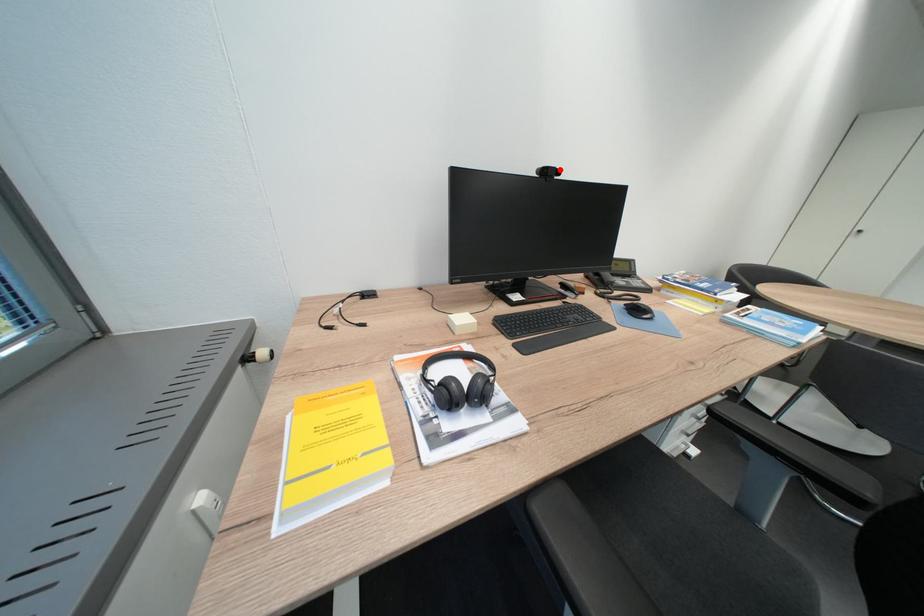
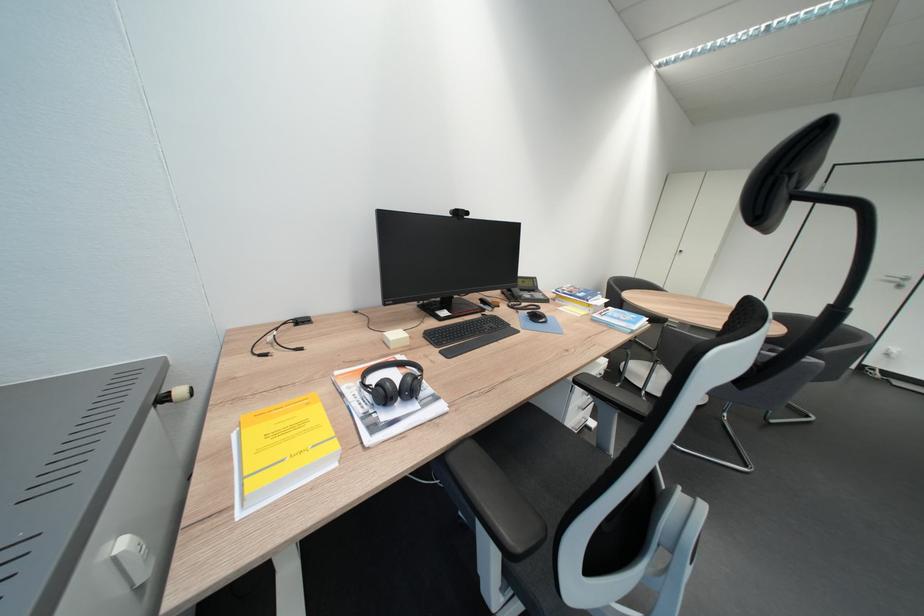
Where in the second image is the point corresponding to the highlighted location from the first image?

(469, 211)